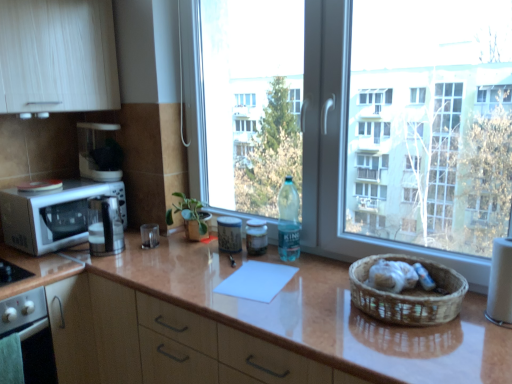
Identify the location of free spot in front of matte glass jar at center, marked as the 3th appliance in a top-to-bottom arrangement. (256, 270).